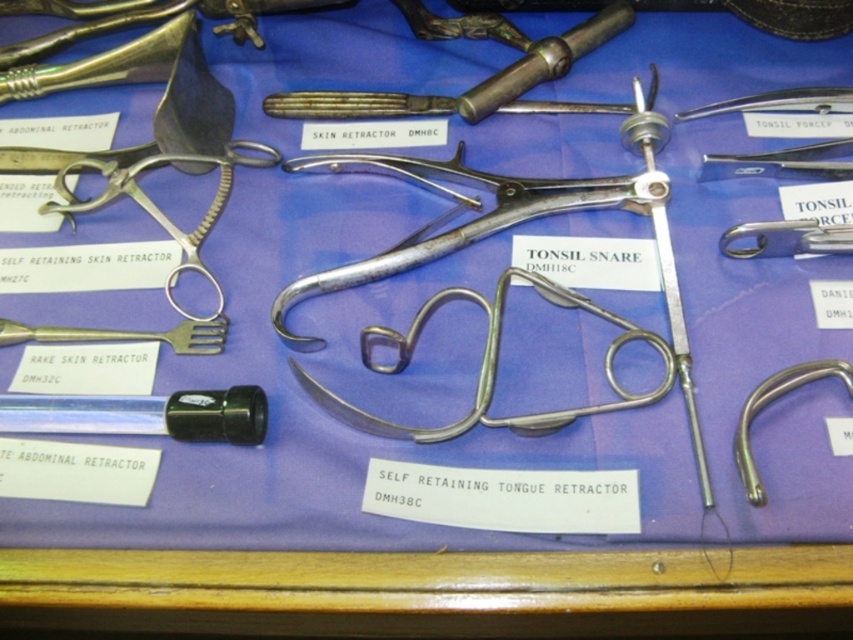
You are a medical student observing the surgical instruments displayed on the blue fabric. You notice the black plastic tube at lower left and the silver metallic hook at right. Which object is positioned higher in the image?

The black plastic tube at lower left is located above the silver metallic hook at right, so it is positioned higher in the image.

You are a medical student observing the surgical instrument display. You need to locate the black plastic tube at lower left. According to the coordinates provided, where exactly is it positioned on the display?

The black plastic tube at lower left is positioned at coordinates point (144, 413).

You are standing in front of the surgical instrument display. There are two points marked on the image at coordinates point (241, 429) and point (106, 195). Which point is closer to your viewpoint?

Point (241, 429) is closer to the camera than point (106, 195).